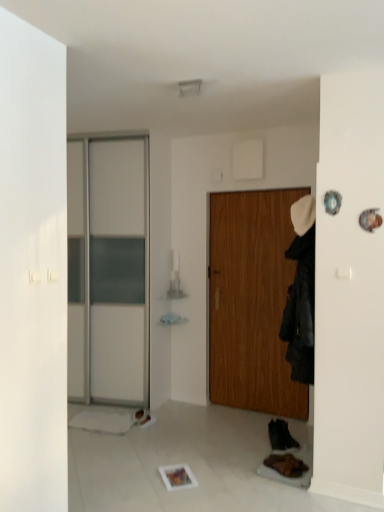
Identify the location of spots to the right of white leather shoe at lower center, which ranks as the 1th shoe in back-to-front order. Image resolution: width=384 pixels, height=512 pixels. (170, 420).